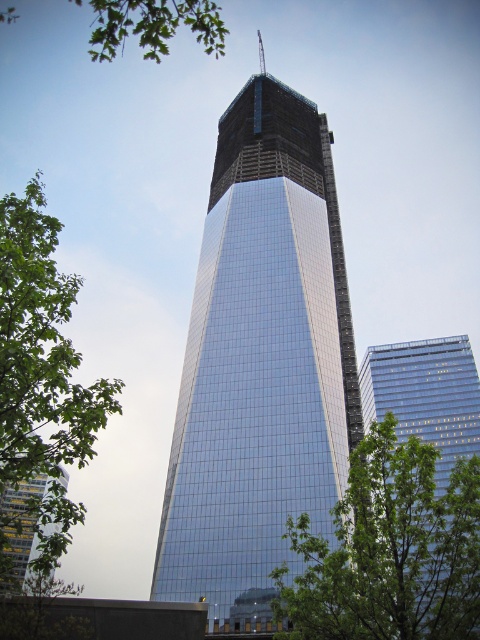
The image size is (480, 640). In order to click on glossy glass skyscraper at center in this screenshot , I will do `click(260, 362)`.

Does glossy glass skyscraper at center appear under green leafy tree at left?

No.

What do you see at coordinates (260, 362) in the screenshot?
I see `glossy glass skyscraper at center` at bounding box center [260, 362].

Identify the location of glossy glass skyscraper at center. This screenshot has width=480, height=640. (260, 362).

Identify the location of green leafy tree at left. (40, 352).

Does green leafy tree at left have a smaller size compared to glassy reflective skyscraper at right?

Actually, green leafy tree at left might be larger than glassy reflective skyscraper at right.

What are the coordinates of `green leafy tree at left` in the screenshot? It's located at (40, 352).

Does green leafy tree at left lie behind green leafy branch at upper left?

No.

Does green leafy tree at left appear on the right side of green leafy branch at upper left?

No, green leafy tree at left is not to the right of green leafy branch at upper left.

Who is more forward, (58, 310) or (224, 33)?

Point (58, 310) is more forward.

This screenshot has width=480, height=640. I want to click on green leafy tree at left, so click(40, 352).